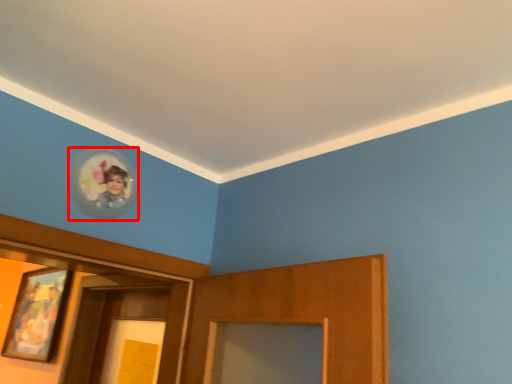
Question: From the image's perspective, considering the relative positions of picture frame (annotated by the red box) and picture frame in the image provided, where is picture frame (annotated by the red box) located with respect to the staircase?

Choices:
 (A) below
 (B) above

Answer: (B)